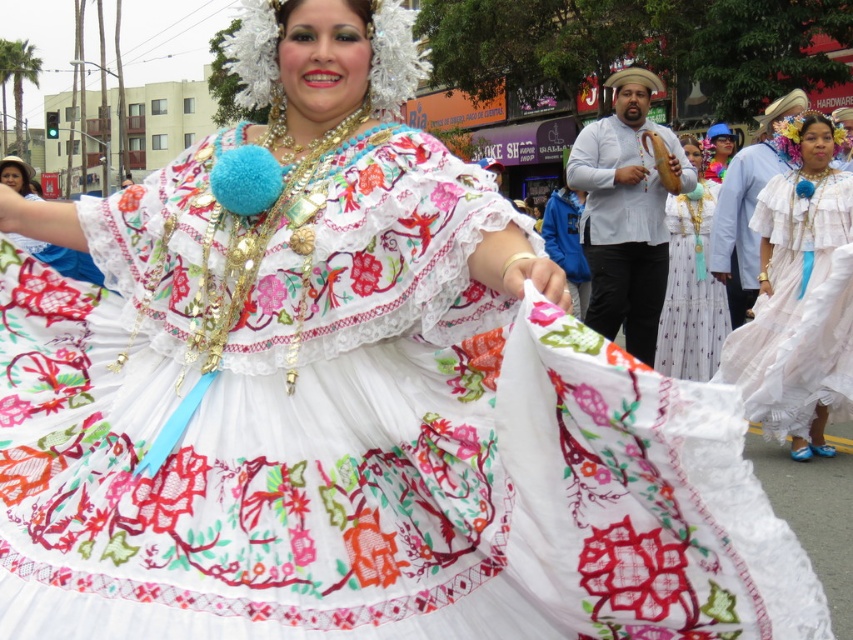
Is white embroidered dress at center thinner than matte blue hat at upper center?

Yes, white embroidered dress at center is thinner than matte blue hat at upper center.

Does point (83, 269) lie behind point (711, 154)?

No.

The height and width of the screenshot is (640, 853). In order to click on white embroidered dress at center in this screenshot , I will do `click(61, 259)`.

Who is positioned more to the left, white cotton dress at center or white embroidered dress at center?

white embroidered dress at center is more to the left.

Which is below, white cotton dress at center or white embroidered dress at center?

white cotton dress at center is lower down.

Is point (782, 150) less distant than point (84, 276)?

No, (782, 150) is behind (84, 276).

Where is `white cotton dress at center`? The image size is (853, 640). white cotton dress at center is located at coordinates (791, 276).

Which is above, white cotton dress at center or matte blue hat at upper center?

Positioned higher is matte blue hat at upper center.

Is point (747, 333) farther from viewer compared to point (720, 147)?

No, (747, 333) is in front of (720, 147).

Where is `white cotton dress at center`? Image resolution: width=853 pixels, height=640 pixels. white cotton dress at center is located at coordinates (791, 276).